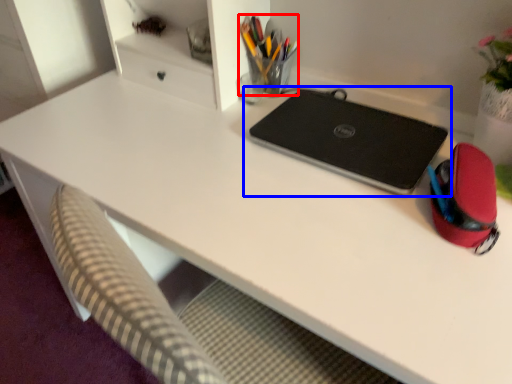
Question: Among these objects, which one is nearest to the camera, stationery (highlighted by a red box) or laptop (highlighted by a blue box)?

Choices:
 (A) stationery
 (B) laptop

Answer: (B)